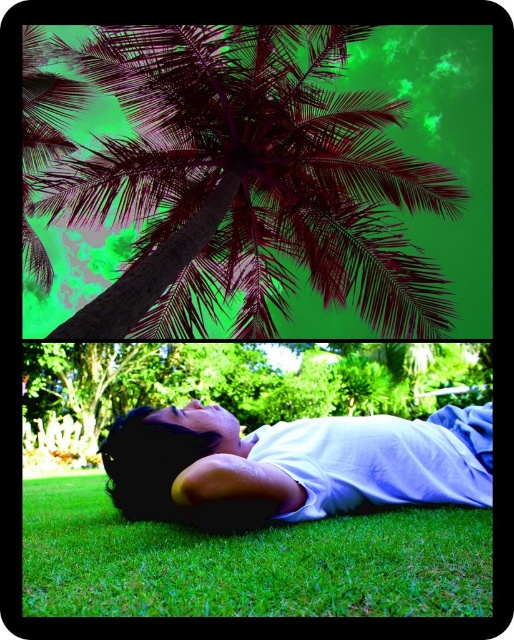
You are an observer looking at the image. The dark purple leafy coconut tree at upper center and the white cotton shirt at lower center are both visible. Which object is positioned higher in the image?

The dark purple leafy coconut tree at upper center is positioned higher in the image than the white cotton shirt at lower center.

You are a photographer trying to capture the person lying on the green soft grass at lower center. Since the white cotton shirt at lower center is smaller than the grass, will the shirt be easily visible in your photo?

The green soft grass at lower center is bigger than the white cotton shirt at lower center, so the shirt may be partially hidden or less prominent in the photo, making it harder to see clearly.

You are an architect designing a new botanical garden. You need to place a new statue exactly at the center of the image. However, you must ensure that the statue does not block the view of the dark purple leafy coconut tree at upper center. Based on the coordinates provided, will the statue interfere with the view of the tree?

The dark purple leafy coconut tree at upper center is positioned at coordinates point [247,182]. Since the statue is placed at the exact center of the image, which is point [257,320], the tree is located to the left and slightly below the statue. Therefore, the statue will not block the view of the dark purple leafy coconut tree at upper center.